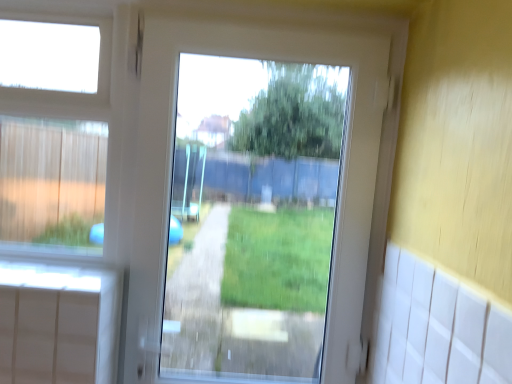
Question: From the image's perspective, is white plastic window at upper left on top of white plastic screen door at center?

Choices:
 (A) yes
 (B) no

Answer: (A)

Question: Is the position of white plastic window at upper left less distant than that of white plastic screen door at center?

Choices:
 (A) yes
 (B) no

Answer: (B)

Question: Is there a large distance between white plastic window at upper left and white plastic screen door at center?

Choices:
 (A) yes
 (B) no

Answer: (B)

Question: Does white plastic window at upper left have a greater height compared to white plastic screen door at center?

Choices:
 (A) yes
 (B) no

Answer: (B)

Question: Considering the relative sizes of white plastic window at upper left and white plastic screen door at center in the image provided, is white plastic window at upper left thinner than white plastic screen door at center?

Choices:
 (A) yes
 (B) no

Answer: (A)

Question: From a real-world perspective, is white plastic window at upper left on white plastic screen door at center?

Choices:
 (A) yes
 (B) no

Answer: (A)

Question: From a real-world perspective, is white plastic screen door at center physically above white plastic window at upper left?

Choices:
 (A) yes
 (B) no

Answer: (B)

Question: Does white plastic screen door at center appear on the left side of white plastic window at upper left?

Choices:
 (A) yes
 (B) no

Answer: (B)

Question: Are white plastic screen door at center and white plastic window at upper left making contact?

Choices:
 (A) yes
 (B) no

Answer: (B)

Question: Is white plastic window at upper left surrounded by white plastic screen door at center?

Choices:
 (A) no
 (B) yes

Answer: (A)

Question: Is white plastic screen door at center shorter than white plastic window at upper left?

Choices:
 (A) yes
 (B) no

Answer: (B)

Question: Is the depth of white plastic screen door at center less than that of white plastic window at upper left?

Choices:
 (A) yes
 (B) no

Answer: (A)

Question: From a real-world perspective, is white plastic screen door at center physically located above or below white plastic window at upper left?

Choices:
 (A) below
 (B) above

Answer: (A)